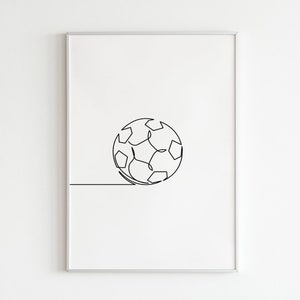
What are the coordinates of `wall` in the screenshot? It's located at (24, 178), (251, 191), (166, 22), (170, 290).